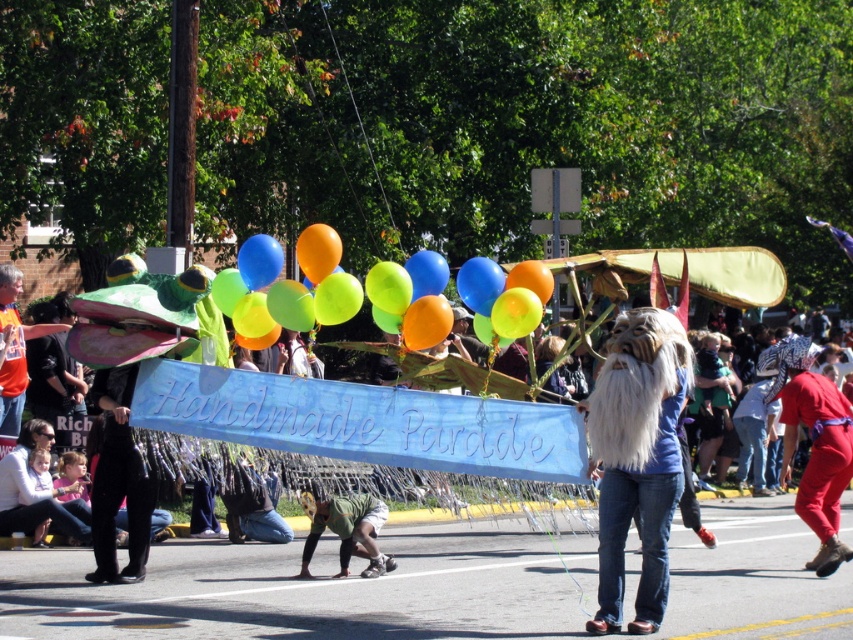
You are standing at the edge of the parade route and want to take a photo of the red jumpsuit at lower right and the blue rubber balloon at center in the same frame. The camera you have can capture objects within a 5 meter range. Will both objects be in the frame?

The red jumpsuit at lower right is 4.38 meters away from the blue rubber balloon at center. Since the maximum range of the camera is 5 meters, both objects will be within the frame as their distance apart is less than 5 meters.